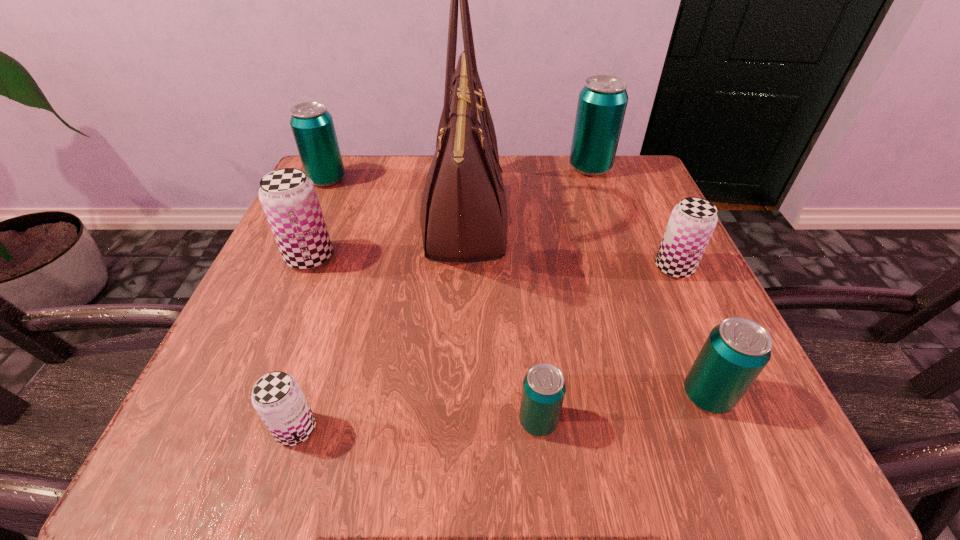
Image resolution: width=960 pixels, height=540 pixels. Find the location of `free spot between the second smallest teal beer can and the handbag`. free spot between the second smallest teal beer can and the handbag is located at coordinates (586, 308).

You are a GUI agent. You are given a task and a screenshot of the screen. Output one action in this format:
    pyautogui.click(x=<x>, y=<y>)
    Task: Click on the free space between the smallest purple beer can and the third biggest teal beer can
    
    Given the screenshot: What is the action you would take?
    pyautogui.click(x=502, y=413)

Identify the location of free space between the rightmost purple beer can and the third teal beer can from right to left. This screenshot has height=540, width=960. (606, 345).

Find the location of `unoccupied area between the leftmost purple beer can and the second smallest teal beer can`. unoccupied area between the leftmost purple beer can and the second smallest teal beer can is located at coordinates (509, 326).

This screenshot has width=960, height=540. I want to click on free space between the second smallest teal beer can and the handbag, so click(586, 308).

What are the coordinates of `empty space that is in between the rightmost purple beer can and the fifth beer can from right to left` in the screenshot? It's located at 485,348.

At what (x,y) coordinates should I click in order to perform the action: click on vacant area that lies between the third teal beer can from right to left and the leftmost purple beer can. Please return your answer as a coordinate pair (x, y). The width and height of the screenshot is (960, 540). Looking at the image, I should click on (424, 339).

The height and width of the screenshot is (540, 960). In order to click on object that is the third nearest to the sixth object from right to left in this screenshot , I will do `click(289, 199)`.

Identify which object is the third closest to the third biggest teal beer can. Please provide its 2D coordinates. Your answer should be formatted as a tuple, i.e. [(x, y)], where the tuple contains the x and y coordinates of a point satisfying the conditions above.

[(463, 216)]

This screenshot has height=540, width=960. I want to click on beer can identified as the third closest to the leftmost purple beer can, so click(543, 391).